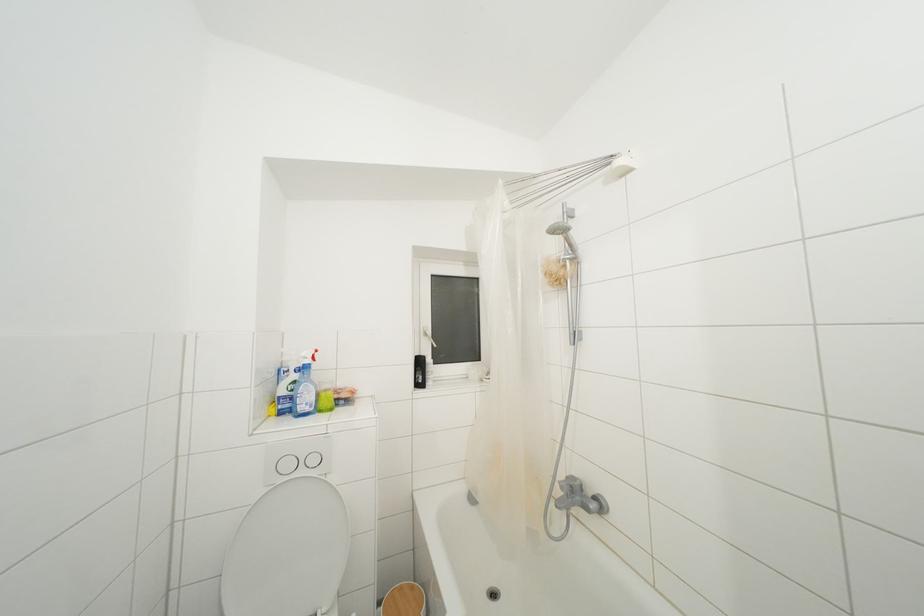
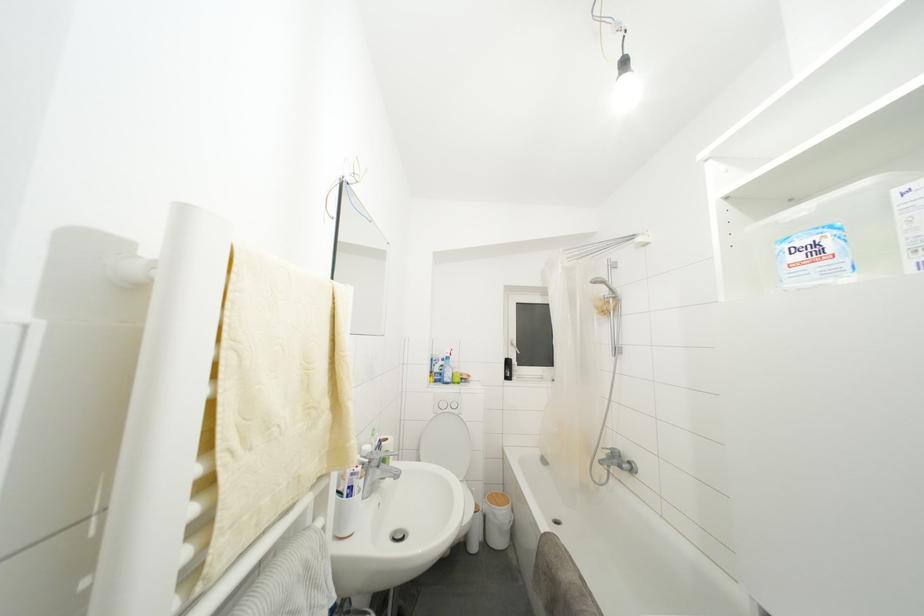
Question: How did the camera likely rotate?

Choices:
 (A) Left
 (B) Right
 (C) Up
 (D) Down

Answer: (A)